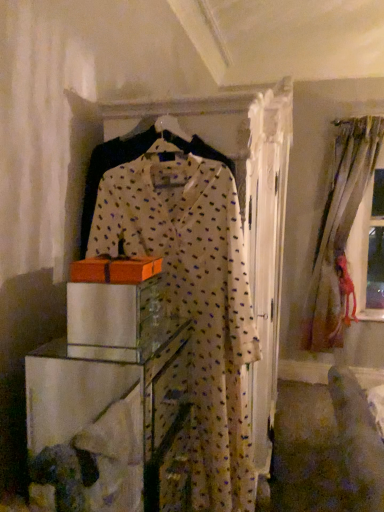
This screenshot has height=512, width=384. I want to click on clear glass cabinet at center, so click(x=106, y=423).

In order to click on white dotted fabric dress at center in this screenshot , I will do `click(194, 300)`.

Does clear glass cabinet at center turn towards silky beige curtains at right?

No.

Who is shorter, clear glass cabinet at center or silky beige curtains at right?

clear glass cabinet at center.

From a real-world perspective, between clear glass cabinet at center and silky beige curtains at right, who is vertically lower?

clear glass cabinet at center.

Is silky beige curtains at right surrounded by clear glass cabinet at center?

No, silky beige curtains at right is not inside clear glass cabinet at center.

In the scene shown: From the image's perspective, is silky beige curtains at right on top of clear glass cabinet at center?

Yes.

Is silky beige curtains at right outside of clear glass cabinet at center?

That's correct, silky beige curtains at right is outside of clear glass cabinet at center.

Is silky beige curtains at right closer to the viewer compared to clear glass cabinet at center?

No.

Would you consider silky beige curtains at right to be distant from clear glass cabinet at center?

Yes, silky beige curtains at right and clear glass cabinet at center are located far from each other.

Find the location of a particular element. window on the right side of white dotted fabric dress at center is located at coordinates (339, 233).

From a real-world perspective, who is located higher, white dotted fabric dress at center or silky beige curtains at right?

silky beige curtains at right, from a real-world perspective.

From the image's perspective, which is above, white dotted fabric dress at center or silky beige curtains at right?

From the image's view, silky beige curtains at right is above.

Looking at this image, based on their sizes in the image, would you say white dotted fabric dress at center is bigger or smaller than silky beige curtains at right?

Clearly, white dotted fabric dress at center is smaller in size than silky beige curtains at right.

From the image's perspective, which is above, white dotted fabric dress at center or orange cardboard box at center?

From the image's view, orange cardboard box at center is above.

Is white dotted fabric dress at center positioned with its back to orange cardboard box at center?

That's right, white dotted fabric dress at center is facing away from orange cardboard box at center.

Which of these two, white dotted fabric dress at center or orange cardboard box at center, is smaller?

Smaller between the two is orange cardboard box at center.

From a real-world perspective, is white dotted fabric dress at center under orange cardboard box at center?

Yes.

Based on the photo, measure the distance between orange cardboard box at center and silky beige curtains at right.

orange cardboard box at center and silky beige curtains at right are 2.73 meters apart from each other.

Is orange cardboard box at center with silky beige curtains at right?

There is a gap between orange cardboard box at center and silky beige curtains at right.

Does orange cardboard box at center have a lesser height compared to silky beige curtains at right?

Yes, orange cardboard box at center is shorter than silky beige curtains at right.

In the scene shown: What's the angular difference between orange cardboard box at center and silky beige curtains at right's facing directions?

92.8 degrees.

Between point (115, 269) and point (115, 387), which one is positioned in front?

The point (115, 269) is closer to the camera.

Do you think orange cardboard box at center is within clear glass cabinet at center, or outside of it?

orange cardboard box at center is not enclosed by clear glass cabinet at center.

Between orange cardboard box at center and clear glass cabinet at center, which one has more height?

clear glass cabinet at center.

How different are the orientations of orange cardboard box at center and clear glass cabinet at center in degrees?

orange cardboard box at center and clear glass cabinet at center are facing 2.76 degrees away from each other.

Is clear glass cabinet at center located outside orange cardboard box at center?

That's correct, clear glass cabinet at center is outside of orange cardboard box at center.

From the image's perspective, is clear glass cabinet at center above orange cardboard box at center?

No, from the image's perspective, clear glass cabinet at center is not on top of orange cardboard box at center.

Considering the relative sizes of clear glass cabinet at center and orange cardboard box at center in the image provided, is clear glass cabinet at center bigger than orange cardboard box at center?

Indeed, clear glass cabinet at center has a larger size compared to orange cardboard box at center.

Is clear glass cabinet at center far from orange cardboard box at center?

clear glass cabinet at center is near orange cardboard box at center, not far away.

Identify the location of window lying on the right of clear glass cabinet at center. (339, 233).

The height and width of the screenshot is (512, 384). Identify the location of furniture in front of the silky beige curtains at right. (106, 423).

Which object lies nearer to the anchor point white dotted fabric dress at center, orange cardboard box at center or clear glass cabinet at center?

orange cardboard box at center.

In the scene shown: Which object lies nearer to the anchor point silky beige curtains at right, orange cardboard box at center or white dotted fabric dress at center?

white dotted fabric dress at center lies closer to silky beige curtains at right than the other object.

Which object lies nearer to the anchor point silky beige curtains at right, clear glass cabinet at center or orange cardboard box at center?

clear glass cabinet at center.

Based on their spatial positions, is silky beige curtains at right or orange cardboard box at center closer to clear glass cabinet at center?

orange cardboard box at center is positioned closer to the anchor clear glass cabinet at center.

Which object lies further to the anchor point clear glass cabinet at center, orange cardboard box at center or silky beige curtains at right?

Based on the image, silky beige curtains at right appears to be further to clear glass cabinet at center.

From the image, which object appears to be nearer to orange cardboard box at center, silky beige curtains at right or white dotted fabric dress at center?

white dotted fabric dress at center is positioned closer to the anchor orange cardboard box at center.

Considering their positions, is clear glass cabinet at center positioned closer to silky beige curtains at right than white dotted fabric dress at center?

white dotted fabric dress at center.

From the image, which object appears to be nearer to clear glass cabinet at center, orange cardboard box at center or white dotted fabric dress at center?

white dotted fabric dress at center is closer to clear glass cabinet at center.

In order to click on fancy dress between orange cardboard box at center and silky beige curtains at right from front to back in this screenshot , I will do `click(194, 300)`.

This screenshot has height=512, width=384. Identify the location of cardboard box positioned between clear glass cabinet at center and silky beige curtains at right from near to far. (115, 269).

The image size is (384, 512). In order to click on fancy dress between orange cardboard box at center and clear glass cabinet at center from top to bottom in this screenshot , I will do `click(194, 300)`.

I want to click on fancy dress positioned between clear glass cabinet at center and silky beige curtains at right from near to far, so click(194, 300).